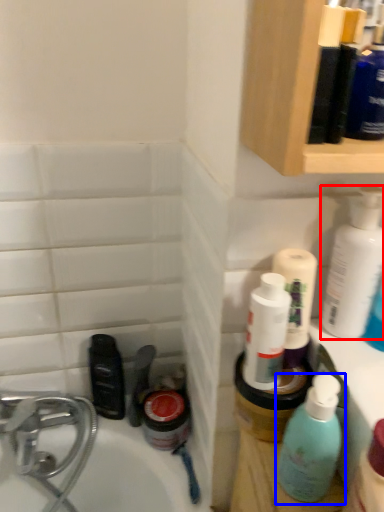
Question: Among these objects, which one is farthest to the camera, cleaning product (highlighted by a red box) or bottle (highlighted by a blue box)?

Choices:
 (A) cleaning product
 (B) bottle

Answer: (A)